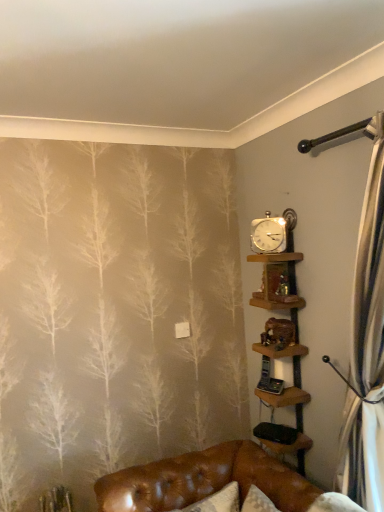
Question: Are gold metallic clock at upper right and wooden shelves at upper right, acting as the 2th shelf starting from the top, beside each other?

Choices:
 (A) yes
 (B) no

Answer: (B)

Question: From a real-world perspective, is gold metallic clock at upper right on top of wooden shelves at upper right, the 1th shelf in the bottom-to-top sequence?

Choices:
 (A) yes
 (B) no

Answer: (A)

Question: From a real-world perspective, is gold metallic clock at upper right beneath wooden shelves at upper right, acting as the 2th shelf starting from the top?

Choices:
 (A) no
 (B) yes

Answer: (A)

Question: Can you confirm if gold metallic clock at upper right is smaller than wooden shelves at upper right, acting as the 2th shelf starting from the top?

Choices:
 (A) no
 (B) yes

Answer: (B)

Question: Does gold metallic clock at upper right have a lesser height compared to wooden shelves at upper right, acting as the 2th shelf starting from the top?

Choices:
 (A) no
 (B) yes

Answer: (B)

Question: Considering the positions of wooden shelf at upper center, marked as the 2th shelf in a bottom-to-top arrangement, and gold metallic clock at upper right in the image, is wooden shelf at upper center, marked as the 2th shelf in a bottom-to-top arrangement, wider or thinner than gold metallic clock at upper right?

Choices:
 (A) wide
 (B) thin

Answer: (A)

Question: Visually, is wooden shelf at upper center, marked as the 2th shelf in a bottom-to-top arrangement, positioned to the left or to the right of gold metallic clock at upper right?

Choices:
 (A) right
 (B) left

Answer: (A)

Question: Is wooden shelf at upper center, which appears as the 1th shelf when viewed from the top, situated inside gold metallic clock at upper right or outside?

Choices:
 (A) outside
 (B) inside

Answer: (A)

Question: Relative to gold metallic clock at upper right, is wooden shelf at upper center, which appears as the 1th shelf when viewed from the top, in front or behind?

Choices:
 (A) front
 (B) behind

Answer: (A)

Question: From the image's perspective, is wooden shelves at upper right, the 1th shelf in the bottom-to-top sequence, located above or below wooden shelf at upper center, marked as the 2th shelf in a bottom-to-top arrangement?

Choices:
 (A) above
 (B) below

Answer: (B)

Question: From a real-world perspective, is wooden shelves at upper right, acting as the 2th shelf starting from the top, physically located above or below wooden shelf at upper center, marked as the 2th shelf in a bottom-to-top arrangement?

Choices:
 (A) above
 (B) below

Answer: (B)

Question: Based on their sizes in the image, would you say wooden shelves at upper right, acting as the 2th shelf starting from the top, is bigger or smaller than wooden shelf at upper center, marked as the 2th shelf in a bottom-to-top arrangement?

Choices:
 (A) big
 (B) small

Answer: (A)

Question: Is point (297, 253) positioned closer to the camera than point (269, 276)?

Choices:
 (A) farther
 (B) closer

Answer: (B)

Question: From a real-world perspective, is wooden shelves at upper right, the 1th shelf in the bottom-to-top sequence, physically located above or below gold metallic clock at upper right?

Choices:
 (A) above
 (B) below

Answer: (B)

Question: Is wooden shelves at upper right, the 1th shelf in the bottom-to-top sequence, in front of or behind gold metallic clock at upper right in the image?

Choices:
 (A) behind
 (B) front

Answer: (B)